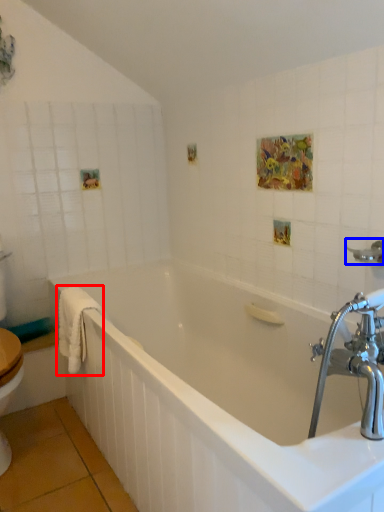
Question: Which object is closer to the camera taking this photo, bath towel (highlighted by a red box) or shower (highlighted by a blue box)?

Choices:
 (A) bath towel
 (B) shower

Answer: (B)